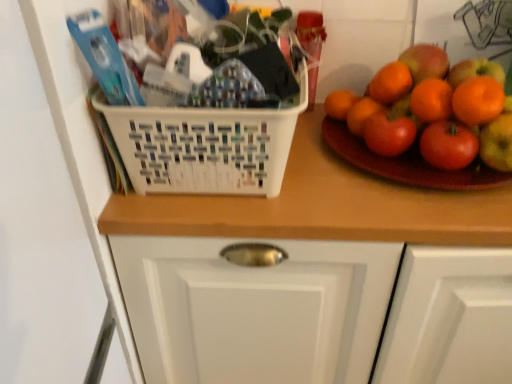
Question: Considering the relative sizes of glossy wooden plate at right and wooden counter at center in the image provided, is glossy wooden plate at right bigger than wooden counter at center?

Choices:
 (A) yes
 (B) no

Answer: (B)

Question: From the image's perspective, is glossy wooden plate at right under wooden counter at center?

Choices:
 (A) yes
 (B) no

Answer: (B)

Question: From the image's perspective, is glossy wooden plate at right above wooden counter at center?

Choices:
 (A) no
 (B) yes

Answer: (B)

Question: Can you confirm if glossy wooden plate at right is taller than wooden counter at center?

Choices:
 (A) yes
 (B) no

Answer: (B)

Question: Does glossy wooden plate at right have a greater width compared to wooden counter at center?

Choices:
 (A) no
 (B) yes

Answer: (A)

Question: Does point (368, 190) appear closer or farther from the camera than point (258, 155)?

Choices:
 (A) farther
 (B) closer

Answer: (A)

Question: From the image's perspective, is wooden counter at center located above or below white plastic basket at center?

Choices:
 (A) above
 (B) below

Answer: (B)

Question: Looking at their shapes, would you say wooden counter at center is wider or thinner than white plastic basket at center?

Choices:
 (A) wide
 (B) thin

Answer: (A)

Question: From a real-world perspective, is wooden counter at center above or below white plastic basket at center?

Choices:
 (A) above
 (B) below

Answer: (B)

Question: Is glossy wooden plate at right spatially inside wooden counter at center, or outside of it?

Choices:
 (A) outside
 (B) inside

Answer: (A)

Question: From the image's perspective, is glossy wooden plate at right located above or below wooden counter at center?

Choices:
 (A) above
 (B) below

Answer: (A)

Question: Is glossy wooden plate at right wider or thinner than wooden counter at center?

Choices:
 (A) wide
 (B) thin

Answer: (B)

Question: From their relative heights in the image, would you say glossy wooden plate at right is taller or shorter than wooden counter at center?

Choices:
 (A) short
 (B) tall

Answer: (A)

Question: Considering the positions of white plastic basket at center and wooden counter at center in the image, is white plastic basket at center taller or shorter than wooden counter at center?

Choices:
 (A) short
 (B) tall

Answer: (A)

Question: In terms of size, does white plastic basket at center appear bigger or smaller than wooden counter at center?

Choices:
 (A) small
 (B) big

Answer: (A)